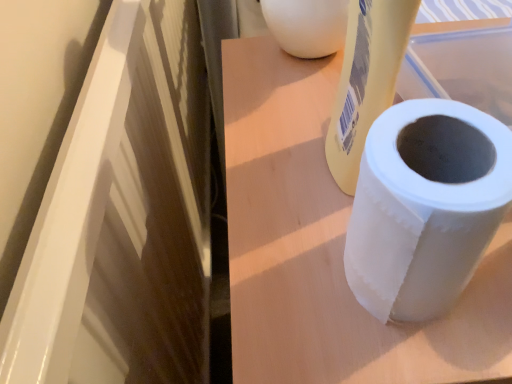
You are a GUI agent. You are given a task and a screenshot of the screen. Output one action in this format:
    pyautogui.click(x=<x>, y=<y>)
    Task: Click on the white matte toilet paper at right
    
    Given the screenshot: What is the action you would take?
    pyautogui.click(x=425, y=206)

Describe the element at coordinates (425, 206) in the screenshot. I see `white matte toilet paper at right` at that location.

Image resolution: width=512 pixels, height=384 pixels. Describe the element at coordinates (326, 248) in the screenshot. I see `white matte paper towel roll at center` at that location.

This screenshot has width=512, height=384. Find the location of `white matte paper towel roll at center`. white matte paper towel roll at center is located at coordinates (326, 248).

This screenshot has height=384, width=512. I want to click on white matte toilet paper at right, so click(425, 206).

Looking at this image, can you confirm if white matte paper towel roll at center is positioned to the left of white matte toilet paper at right?

No.

Is white matte paper towel roll at center behind white matte toilet paper at right?

Yes, it is.

Is point (487, 254) closer to camera compared to point (392, 206)?

No, (487, 254) is further to viewer.

From the image's perspective, would you say white matte paper towel roll at center is positioned over white matte toilet paper at right?

No, from the image's perspective, white matte paper towel roll at center is not over white matte toilet paper at right.

From a real-world perspective, between white matte paper towel roll at center and white matte toilet paper at right, who is vertically lower?

From a 3D spatial view, white matte paper towel roll at center is below.

Is white matte paper towel roll at center wider than white matte toilet paper at right?

Indeed, white matte paper towel roll at center has a greater width compared to white matte toilet paper at right.

In terms of height, does white matte paper towel roll at center look taller or shorter compared to white matte toilet paper at right?

white matte paper towel roll at center is taller than white matte toilet paper at right.

Considering the relative sizes of white matte paper towel roll at center and white matte toilet paper at right in the image provided, is white matte paper towel roll at center bigger than white matte toilet paper at right?

Indeed, white matte paper towel roll at center has a larger size compared to white matte toilet paper at right.

Is white matte paper towel roll at center inside the boundaries of white matte toilet paper at right, or outside?

white matte paper towel roll at center is outside white matte toilet paper at right.

Is white matte paper towel roll at center not close to white matte toilet paper at right?

No, white matte paper towel roll at center is not far away from white matte toilet paper at right.

Is white matte toilet paper at right at the back of white matte paper towel roll at center?

No, white matte paper towel roll at center's orientation is not away from white matte toilet paper at right.

Identify the location of table behind the white matte toilet paper at right. (326, 248).

Does white matte toilet paper at right appear on the left side of white matte paper towel roll at center?

Yes, white matte toilet paper at right is to the left of white matte paper towel roll at center.

Looking at this image, between white matte toilet paper at right and white matte paper towel roll at center, which one is positioned in front?

Positioned in front is white matte toilet paper at right.

Which is nearer, (411, 128) or (277, 294)?

Point (411, 128) is positioned closer to the camera compared to point (277, 294).

From the image's perspective, is white matte toilet paper at right below white matte paper towel roll at center?

Incorrect, from the image's perspective, white matte toilet paper at right is higher than white matte paper towel roll at center.

From a real-world perspective, is white matte toilet paper at right over white matte paper towel roll at center?

Yes, from a real-world perspective, white matte toilet paper at right is above white matte paper towel roll at center.

Between white matte toilet paper at right and white matte paper towel roll at center, which one has smaller width?

white matte toilet paper at right.

Considering the sizes of white matte toilet paper at right and white matte paper towel roll at center in the image, is white matte toilet paper at right taller or shorter than white matte paper towel roll at center?

In the image, white matte toilet paper at right appears to be shorter than white matte paper towel roll at center.

Is white matte toilet paper at right bigger or smaller than white matte paper towel roll at center?

white matte toilet paper at right is smaller than white matte paper towel roll at center.

Is white matte toilet paper at right not inside white matte paper towel roll at center?

Yes, white matte toilet paper at right is outside of white matte paper towel roll at center.

Is white matte toilet paper at right directly adjacent to white matte paper towel roll at center?

No.

Is white matte toilet paper at right positioned with its back to white matte paper towel roll at center?

No, white matte toilet paper at right's orientation is not away from white matte paper towel roll at center.

How many degrees apart are the facing directions of white matte toilet paper at right and white matte paper towel roll at center?

There is a 0.000841-degree angle between the facing directions of white matte toilet paper at right and white matte paper towel roll at center.

Image resolution: width=512 pixels, height=384 pixels. Find the location of `table that is on the right side of white matte toilet paper at right`. table that is on the right side of white matte toilet paper at right is located at coordinates (326, 248).

Image resolution: width=512 pixels, height=384 pixels. I want to click on toilet paper lying in front of the white matte paper towel roll at center, so click(425, 206).

This screenshot has height=384, width=512. Identify the location of toilet paper above the white matte paper towel roll at center (from the image's perspective). (425, 206).